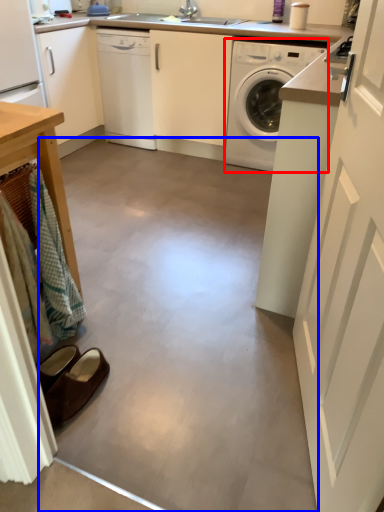
Question: Which of the following is the closest to the observer, washing machine (highlighted by a red box) or concrete (highlighted by a blue box)?

Choices:
 (A) washing machine
 (B) concrete

Answer: (B)